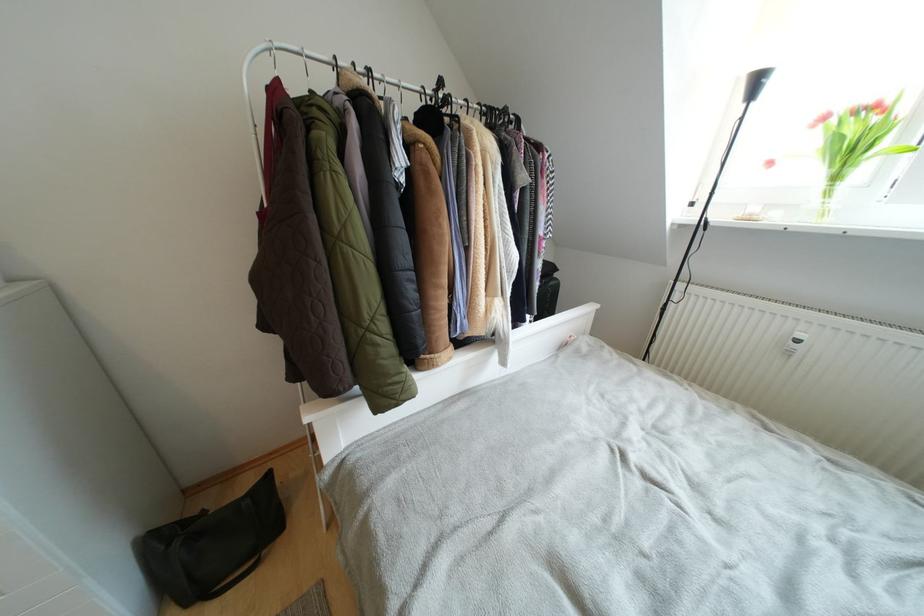
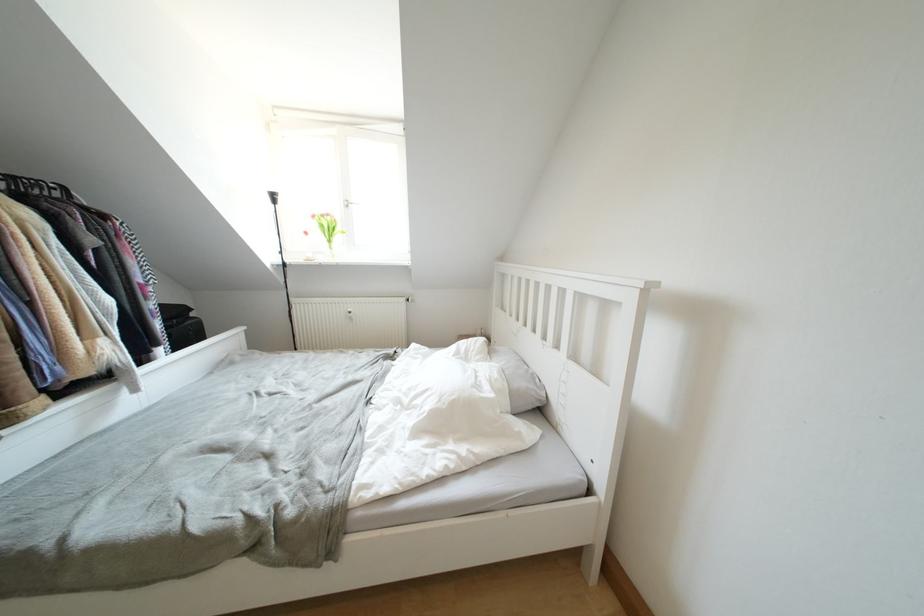
Find the pixel in the second image that matches point (830, 122) in the first image.

(319, 220)